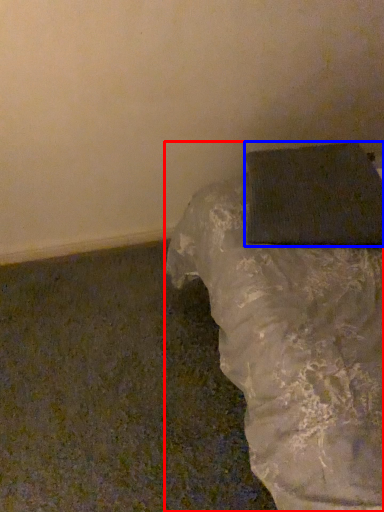
Question: Which object is closer to the camera taking this photo, furniture (highlighted by a red box) or wrapping paper (highlighted by a blue box)?

Choices:
 (A) furniture
 (B) wrapping paper

Answer: (A)